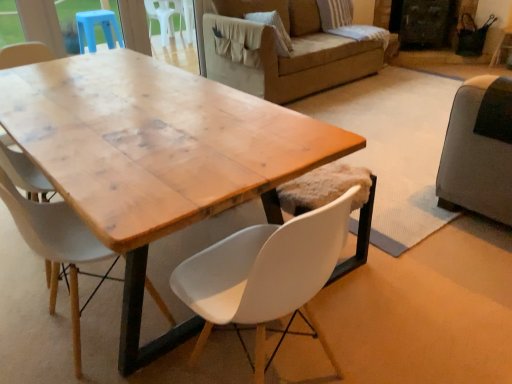
Question: From a real-world perspective, is white plastic chair at center, which appears as the second chair when viewed from the left, positioned above or below striped fabric pillow at upper right?

Choices:
 (A) below
 (B) above

Answer: (A)

Question: Considering the positions of point (321, 248) and point (276, 29), is point (321, 248) closer or farther from the camera than point (276, 29)?

Choices:
 (A) closer
 (B) farther

Answer: (A)

Question: Which object is the closest to the wooden table at center?

Choices:
 (A) white plastic chair at center, which appears as the second chair when viewed from the left
 (B) black matte screen door at upper right
 (C) dark gray fabric couch at right
 (D) white matte chair at center, the 2th chair viewed from the right
 (E) striped fabric pillow at upper right

Answer: (D)

Question: Which object is positioned farthest from the dark gray fabric couch at right?

Choices:
 (A) striped fabric pillow at upper right
 (B) wooden table at center
 (C) white matte chair at center, the 2th chair viewed from the right
 (D) white plastic chair at center, which is the first chair from right to left
 (E) black matte screen door at upper right

Answer: (E)